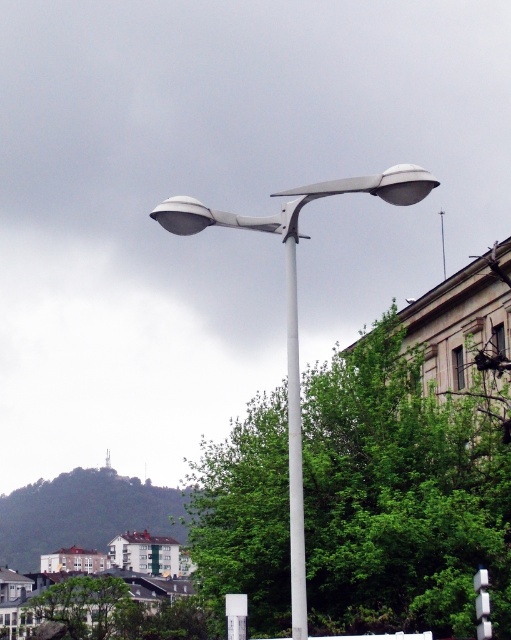
You are a city planner evaluating the placement of the white glossy street light at center and the white plastic sign at center. Considering their heights, which one would block the view of pedestrians standing directly in front of them?

The white glossy street light at center is taller than the white plastic sign at center, so it would block the view of pedestrians standing directly in front of them more than the sign.

You are standing in front of the modern streetlamp described in the scene. There is a specific point at coordinates point (294, 452). What object is located at that point?

The white smooth pole at center is located at point (294, 452).

You are a pedestrian standing in front of the white smooth pole at center and the white plastic sign at center. Which object is closer to your right side?

The white plastic sign at center is closer to your right side because the white smooth pole at center is to the left of it.